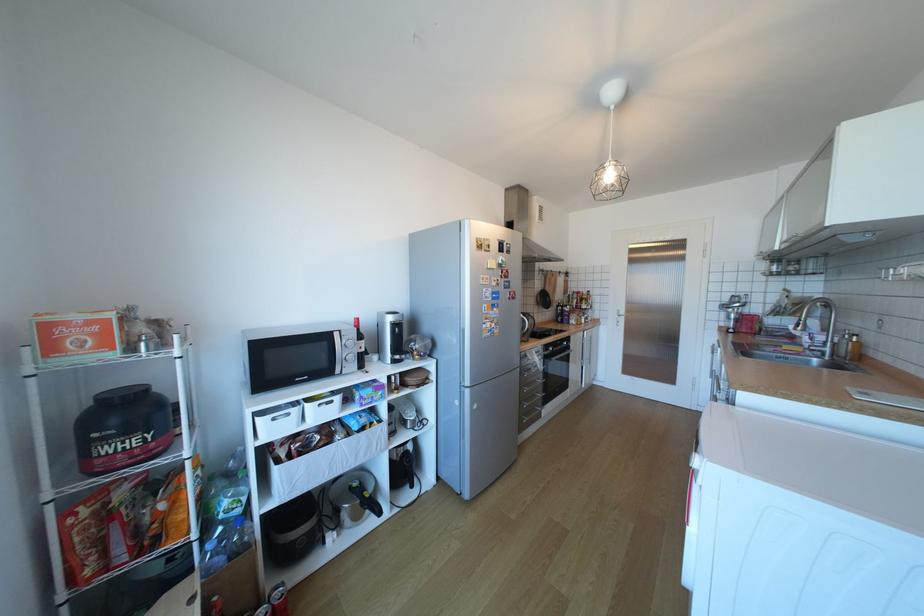
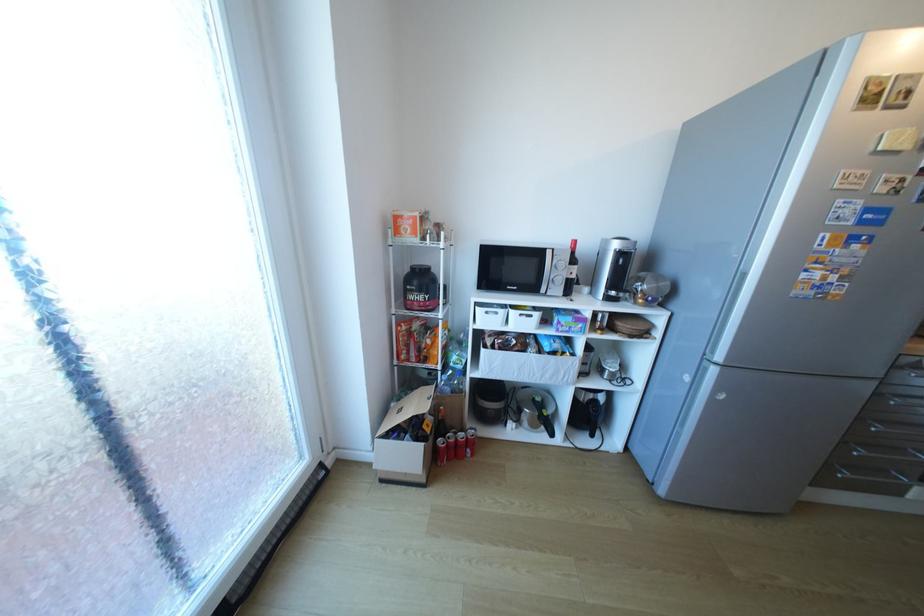
Based on the continuous images, in which direction is the camera rotating?

The camera rotated toward left-down.